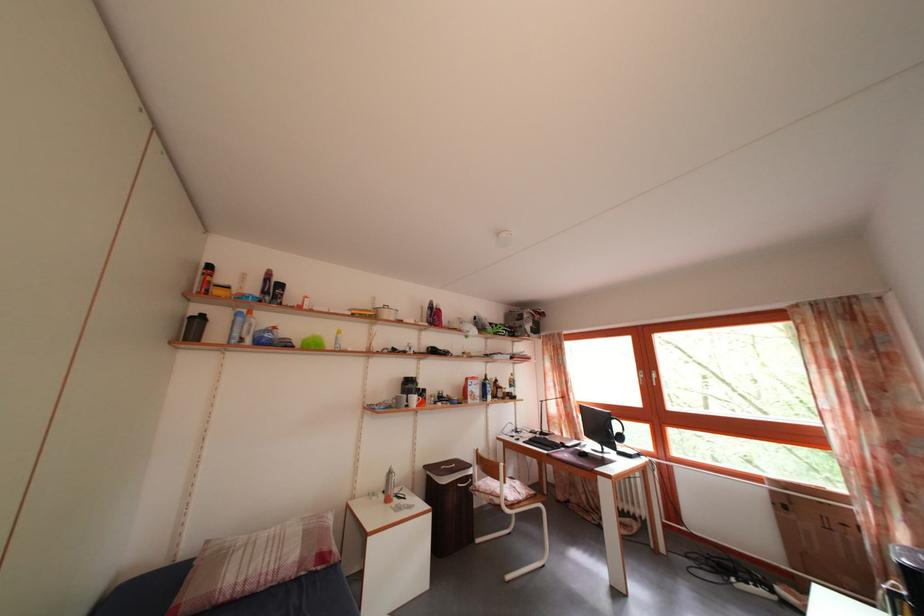
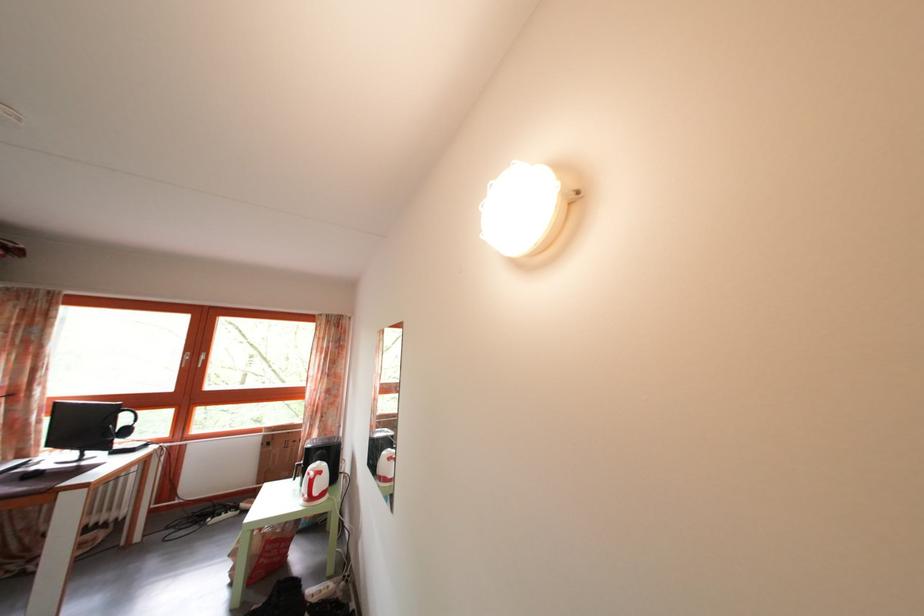
Find the pixel in the second image that matches point (891, 535) in the first image.

(317, 442)